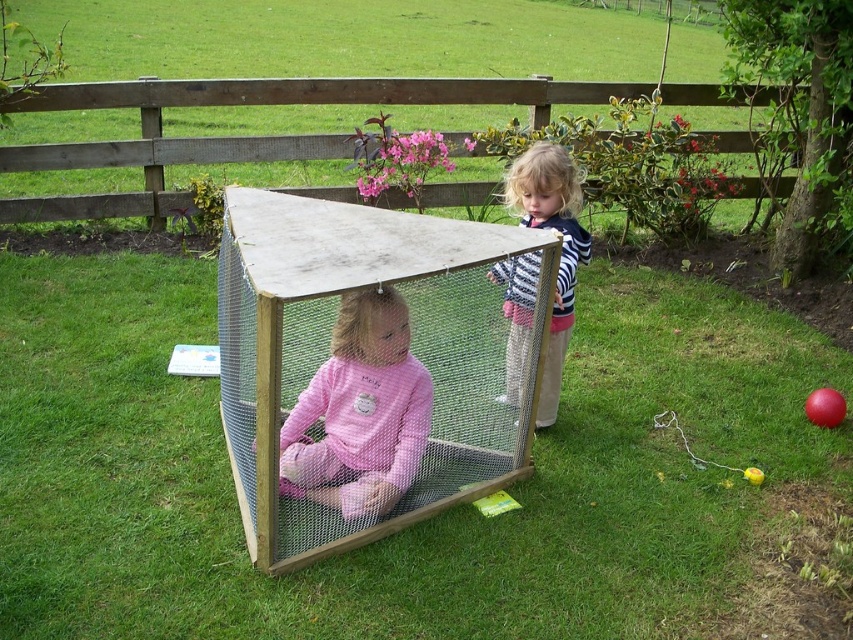
Question: Which point is farther to the camera?

Choices:
 (A) metal mesh cage at center
 (B) striped knit sweater at center
 (C) rubber ball at lower right
 (D) pink fleece at center

Answer: (C)

Question: Does rubber ball at lower right have a larger size compared to yellow rubber ball at lower right?

Choices:
 (A) no
 (B) yes

Answer: (B)

Question: Which point is closer to the camera taking this photo?

Choices:
 (A) (763, 474)
 (B) (579, 244)
 (C) (277, 205)

Answer: (C)

Question: Is pink fleece at center further to the viewer compared to striped knit sweater at center?

Choices:
 (A) no
 (B) yes

Answer: (B)

Question: Is striped knit sweater at center further to camera compared to rubber ball at lower right?

Choices:
 (A) no
 (B) yes

Answer: (A)

Question: Which of the following is the closest to the observer?

Choices:
 (A) metal mesh cage at center
 (B) striped knit sweater at center
 (C) yellow rubber ball at lower right

Answer: (A)